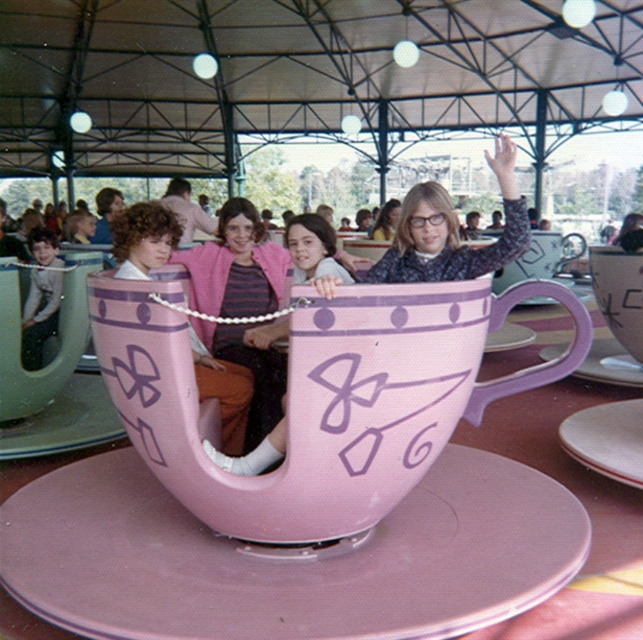
Which of these two, pink matte saucer at center or matte purple cup at center, stands taller?

matte purple cup at center is taller.

Which of these two, pink matte saucer at center or matte purple cup at center, stands shorter?

With less height is pink matte saucer at center.

Image resolution: width=643 pixels, height=640 pixels. Describe the element at coordinates (287, 557) in the screenshot. I see `pink matte saucer at center` at that location.

The image size is (643, 640). I want to click on pink matte saucer at center, so click(287, 557).

Between pink matte saucer at center and white glossy saucer at center, which one appears on the left side from the viewer's perspective?

pink matte saucer at center

Is pink matte saucer at center to the right of white glossy saucer at center from the viewer's perspective?

No, pink matte saucer at center is not to the right of white glossy saucer at center.

Describe the element at coordinates (287, 557) in the screenshot. I see `pink matte saucer at center` at that location.

Locate an element on the screen. pink matte saucer at center is located at coordinates (287, 557).

Does matte pink sweater at center appear on the left side of matte purple cup at center?

Indeed, matte pink sweater at center is positioned on the left side of matte purple cup at center.

Is point (260, 282) farther from camera compared to point (419, 200)?

Yes, point (260, 282) is farther from viewer.

Where is `matte pink sweater at center`? This screenshot has height=640, width=643. matte pink sweater at center is located at coordinates (237, 266).